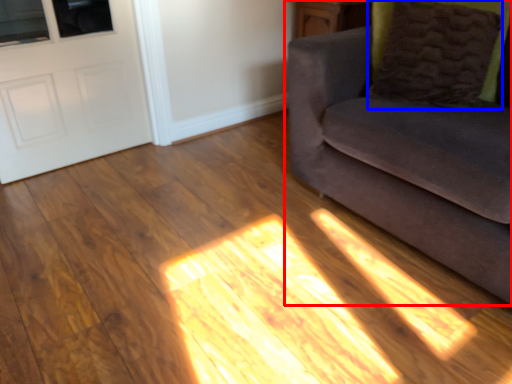
Question: Which of the following is the farthest to the observer, studio couch (highlighted by a red box) or pillow (highlighted by a blue box)?

Choices:
 (A) studio couch
 (B) pillow

Answer: (B)